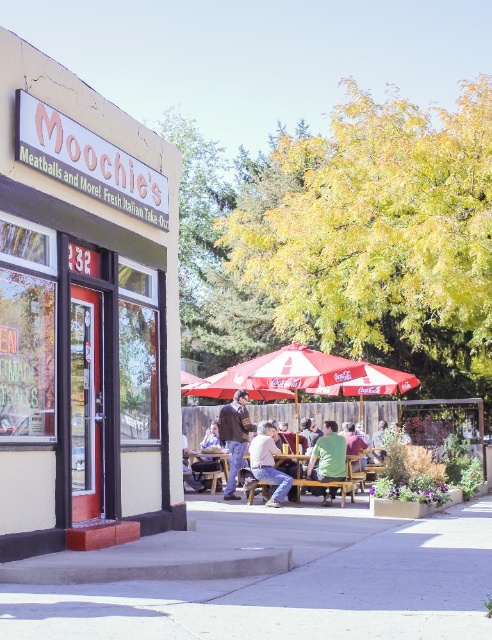
Question: Can you confirm if knitted sweater at center is wider than green matte shirt at center?

Choices:
 (A) no
 (B) yes

Answer: (B)

Question: Among these objects, which one is nearest to the camera?

Choices:
 (A) gray concrete pavement at lower center
 (B) knitted sweater at center
 (C) wooden table at center

Answer: (A)

Question: Which point appears farthest from the camera in this image?

Choices:
 (A) (272, 614)
 (B) (215, 470)

Answer: (B)

Question: Which of the following is the closest to the observer?

Choices:
 (A) green matte shirt at center
 (B) wooden table at center

Answer: (A)

Question: Is the position of light brown leather jacket at center more distant than that of wooden table at center?

Choices:
 (A) no
 (B) yes

Answer: (A)

Question: Is the position of gray concrete pavement at lower center more distant than that of green matte shirt at center?

Choices:
 (A) yes
 (B) no

Answer: (B)